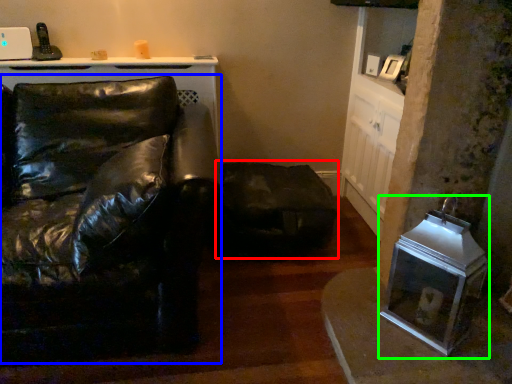
Question: Based on their relative distances, which object is nearer to swivel chair (highlighted by a red box)? Choose from studio couch (highlighted by a blue box) and appliance (highlighted by a green box).

Choices:
 (A) studio couch
 (B) appliance

Answer: (B)